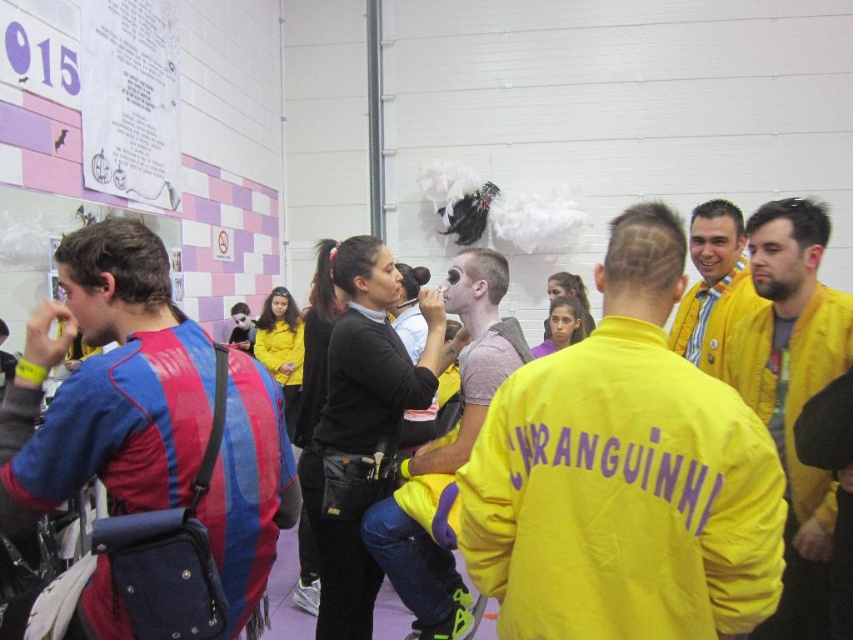
Question: Does yellow fabric jacket at center come in front of blue striped jersey at center?

Choices:
 (A) yes
 (B) no

Answer: (A)

Question: Considering the real-world distances, which object is farthest from the yellow fabric jacket at center?

Choices:
 (A) matte black shirt at center
 (B) yellow matte jacket at right
 (C) blue striped jersey at center

Answer: (A)

Question: Which of these objects is positioned closest to the yellow matte jacket at right?

Choices:
 (A) matte black shirt at center
 (B) blue striped jersey at center

Answer: (A)

Question: Is matte black shirt at center behind yellow matte jacket at center?

Choices:
 (A) no
 (B) yes

Answer: (A)

Question: Which point is closer to the camera?

Choices:
 (A) (x=177, y=499)
 (B) (x=711, y=216)

Answer: (A)

Question: Can you confirm if blue striped jersey at center is positioned to the right of yellow matte jacket at right?

Choices:
 (A) yes
 (B) no

Answer: (B)